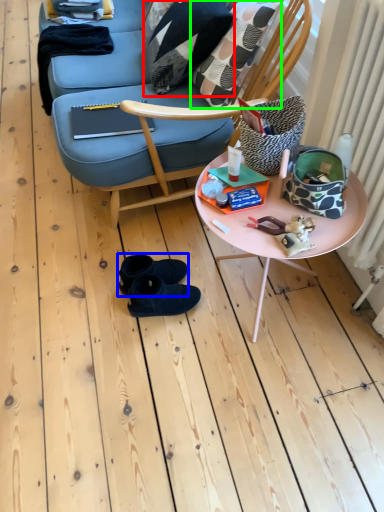
Question: Which is farther away from pillow (highlighted by a red box)? footwear (highlighted by a blue box) or throw pillow (highlighted by a green box)?

Choices:
 (A) footwear
 (B) throw pillow

Answer: (A)